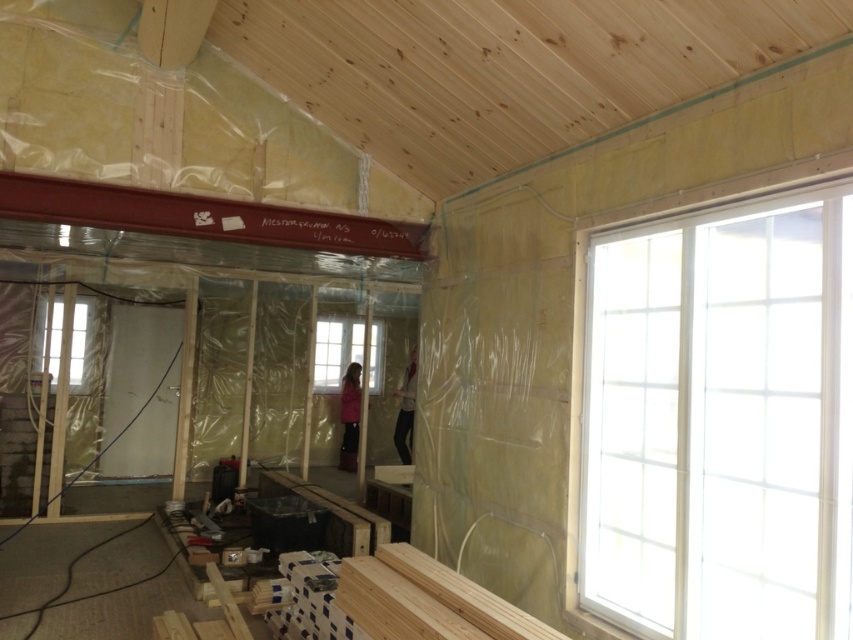
Question: Is clear glass window at upper right wider than clear glass window at left?

Choices:
 (A) no
 (B) yes

Answer: (A)

Question: Which is nearer to the clear glass window at upper right?

Choices:
 (A) clear glass window at center
 (B) light brown wood plank at lower right
 (C) clear glass window at left

Answer: (B)

Question: Can you confirm if clear glass window at upper right is positioned to the left of clear glass window at left?

Choices:
 (A) yes
 (B) no

Answer: (B)

Question: In this image, where is clear glass window at upper right located relative to light brown wood plank at lower right?

Choices:
 (A) left
 (B) right

Answer: (B)

Question: Estimate the real-world distances between objects in this image. Which object is farther from the light brown wood plank at lower right?

Choices:
 (A) clear glass window at left
 (B) clear glass window at center

Answer: (B)

Question: Which object appears farthest from the camera in this image?

Choices:
 (A) clear glass window at center
 (B) clear glass window at left

Answer: (A)